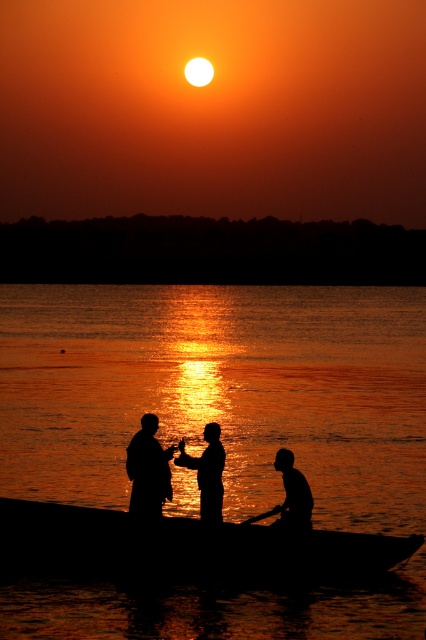
Question: Which object is the closest to the black wood canoe at center?

Choices:
 (A) silhouette wood fisherman at center
 (B) silky water at center

Answer: (A)

Question: Is silky water at center to the right of black wood canoe at center from the viewer's perspective?

Choices:
 (A) yes
 (B) no

Answer: (A)

Question: Among these objects, which one is nearest to the camera?

Choices:
 (A) silky water at center
 (B) black wood canoe at center

Answer: (A)

Question: Does silhouette clothing at center have a greater width compared to silhouette wood fisherman at center?

Choices:
 (A) yes
 (B) no

Answer: (A)

Question: Observing the image, what is the correct spatial positioning of black wood canoe at center in reference to silhouette wood boat at lower center?

Choices:
 (A) below
 (B) above

Answer: (A)

Question: Which point is closer to the camera?

Choices:
 (A) (299, 531)
 (B) (166, 474)

Answer: (A)